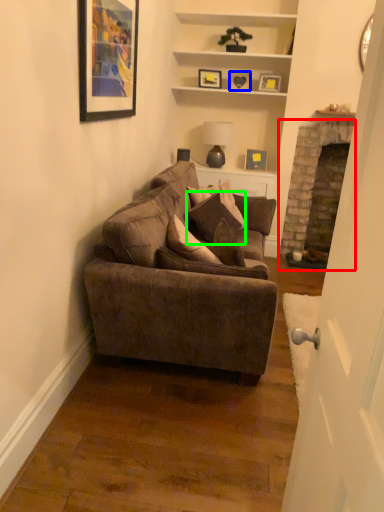
Question: Considering the real-world distances, which object is farthest from fireplace (highlighted by a red box)? picture frame (highlighted by a blue box) or pillow (highlighted by a green box)?

Choices:
 (A) picture frame
 (B) pillow

Answer: (B)